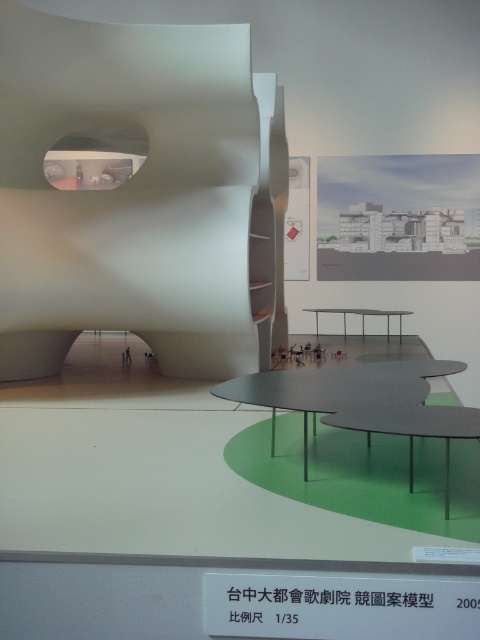
In the scene shown: Which is more to the left, matte gray table at center or matte gray table at lower center?

From the viewer's perspective, matte gray table at center appears more on the left side.

Is matte gray table at center thinner than matte gray table at lower center?

No.

Between point (363, 369) and point (323, 420), which one is positioned behind?

Positioned behind is point (363, 369).

Identify the location of matte gray table at center. (325, 390).

Is matte gray table at center thinner than metallic gray table at center?

Indeed, matte gray table at center has a lesser width compared to metallic gray table at center.

Is matte gray table at center shorter than metallic gray table at center?

Yes.

This screenshot has height=640, width=480. What do you see at coordinates (325, 390) in the screenshot? I see `matte gray table at center` at bounding box center [325, 390].

At what (x,y) coordinates should I click in order to perform the action: click on matte gray table at center. Please return your answer as a coordinate pair (x, y). The height and width of the screenshot is (640, 480). Looking at the image, I should click on (325, 390).

Is matte white sculpture at center to the right of metallic gray table at center from the viewer's perspective?

Incorrect, matte white sculpture at center is not on the right side of metallic gray table at center.

Is matte white sculpture at center closer to the viewer compared to metallic gray table at center?

Yes, matte white sculpture at center is in front of metallic gray table at center.

Which is in front, point (118, 275) or point (345, 326)?

Point (118, 275)

The image size is (480, 640). Find the location of `matte white sculpture at center`. matte white sculpture at center is located at coordinates (141, 195).